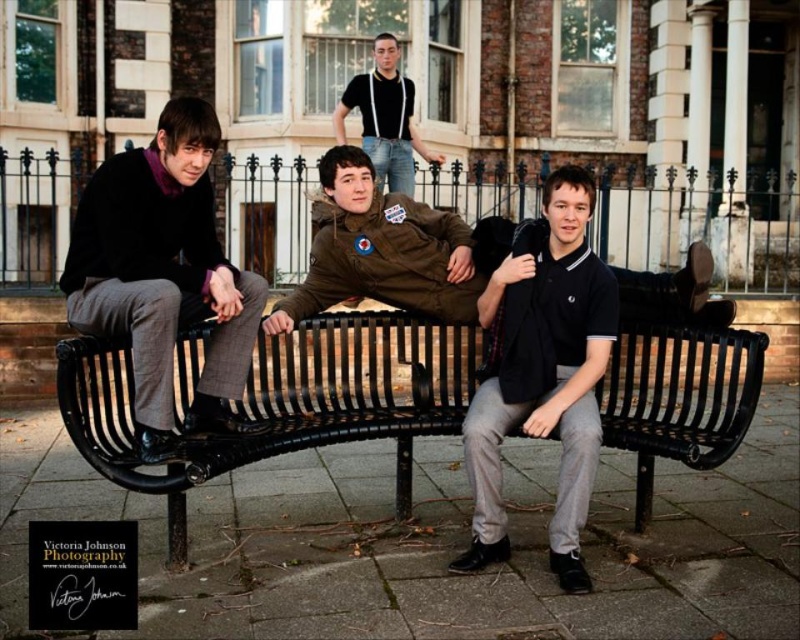
You are standing at the point with coordinates point (152, 490) and want to walk towards the point with coordinates point (196, 422). Which direction should you face to move directly towards it?

You should face backward because point (152, 490) is in front of point (196, 422), so to move towards it, you need to go backward.

You are standing in an urban area and see the black metal bench at center and the matte black sweater at left. Which object is closer to you?

The black metal bench at center is closer to you because it is in front of the matte black sweater at left.

You are a photographer trying to capture a group photo of the matte black sweater at left and the black cotton polo shirt at center. Since you want to ensure both are in the frame, where should you position yourself relative to the subjects?

You should position yourself to the right of the black cotton polo shirt at center so that both the matte black sweater at left and the black cotton polo shirt at center are visible in the frame.